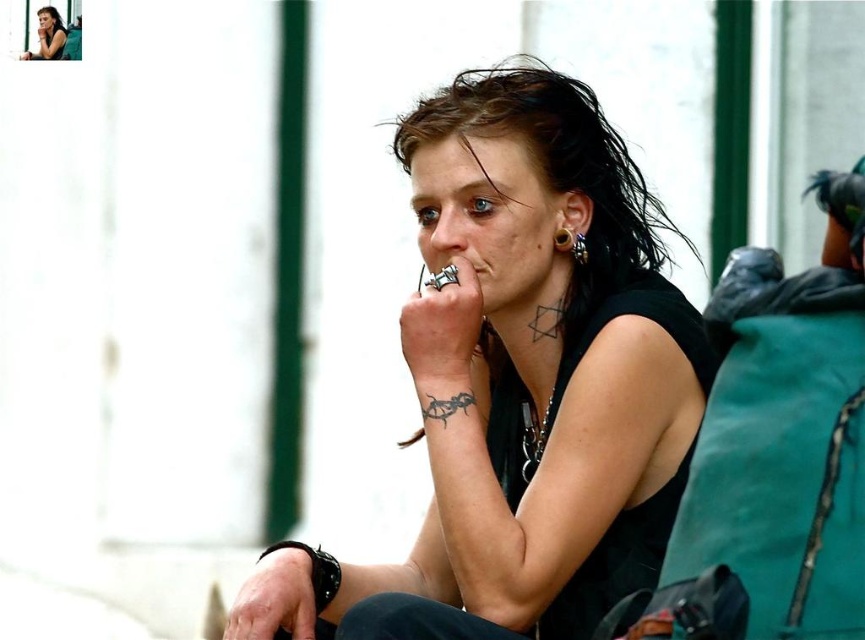
You are an artist sketching the scene and need to place the matte black shirt at center accurately. According to the coordinates provided, where should you position it on your canvas?

The matte black shirt at center should be positioned at coordinates point 0.586 on the x axis and 0.615 on the y axis.

You are a photographer trying to capture a closeup of the gold textured ring at ear and the dark brown hair at upper left. Given that your camera can focus on objects within 10 meters, will both objects be in focus?

The dark brown hair at upper left is 14.16 meters from gold textured ring at ear. Since the camera can only focus within 10 meters, the distance between them exceeds the focus range, so both objects cannot be in focus simultaneously.

Looking at this image, you are a photographer trying to focus on two points in the scene. The first point is at coordinate point (380, 588) and the second is at point (62, 49). Which point should you focus on first to ensure the closest object is in sharp focus?

Point (380, 588) is closer to the camera than point (62, 49), so you should focus on point (380, 588) first to ensure the closest object is in sharp focus.